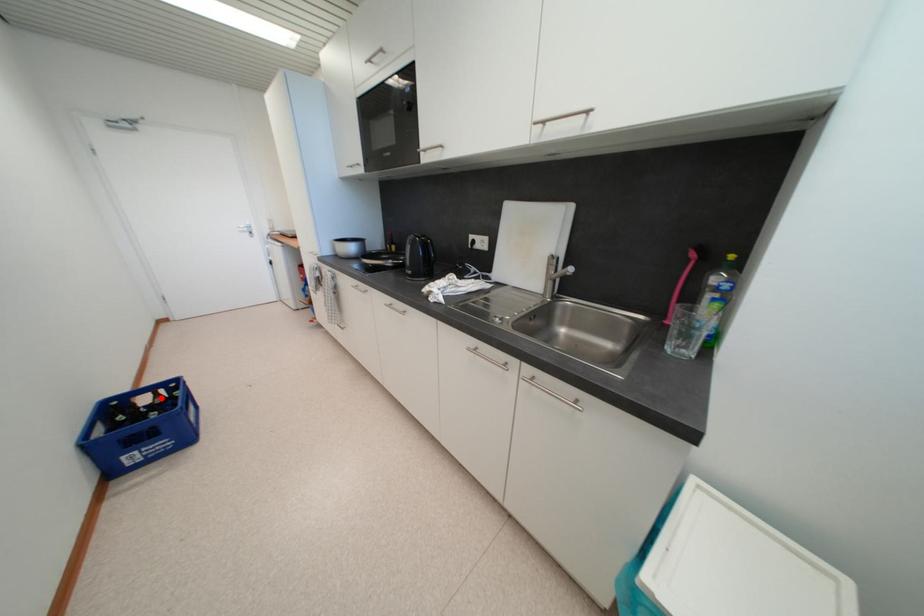
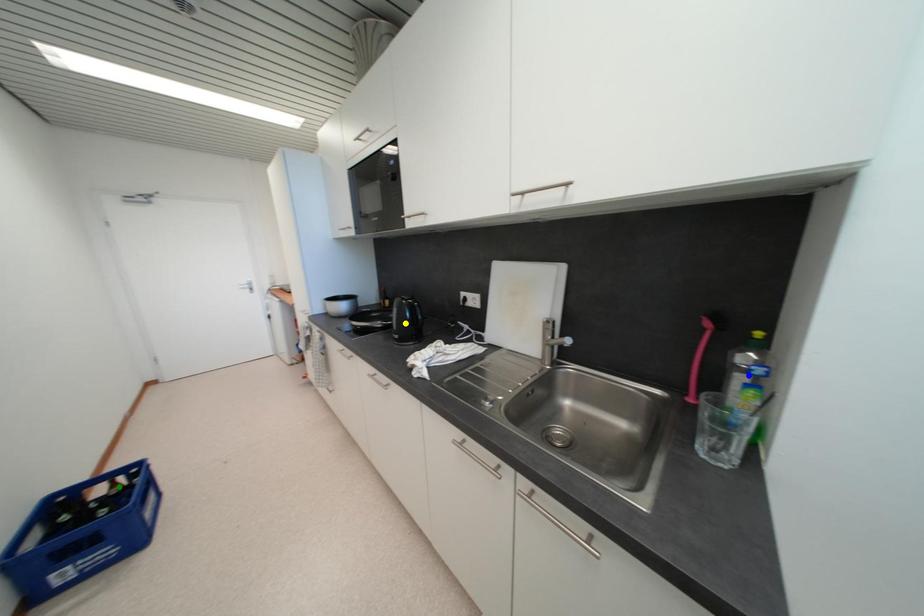
Question: I am providing you with two images of the same scene from different viewpoints. A red point is marked on the first image. You are given multiple points on the second image. Which spot in image 2 lines up with the point in image 1?

Choices:
 (A) yellow point
 (B) blue point
 (C) green point

Answer: (C)